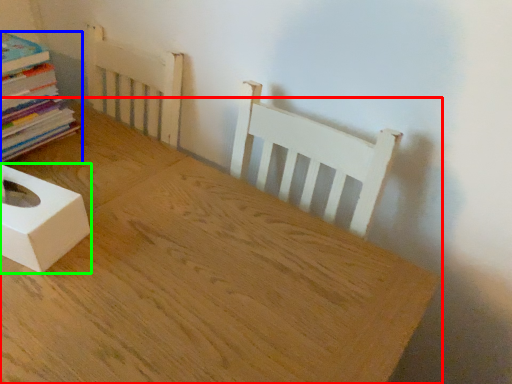
Question: Considering the real-world distances, which object is closest to table (highlighted by a red box)? book (highlighted by a blue box) or box (highlighted by a green box).

Choices:
 (A) book
 (B) box

Answer: (B)